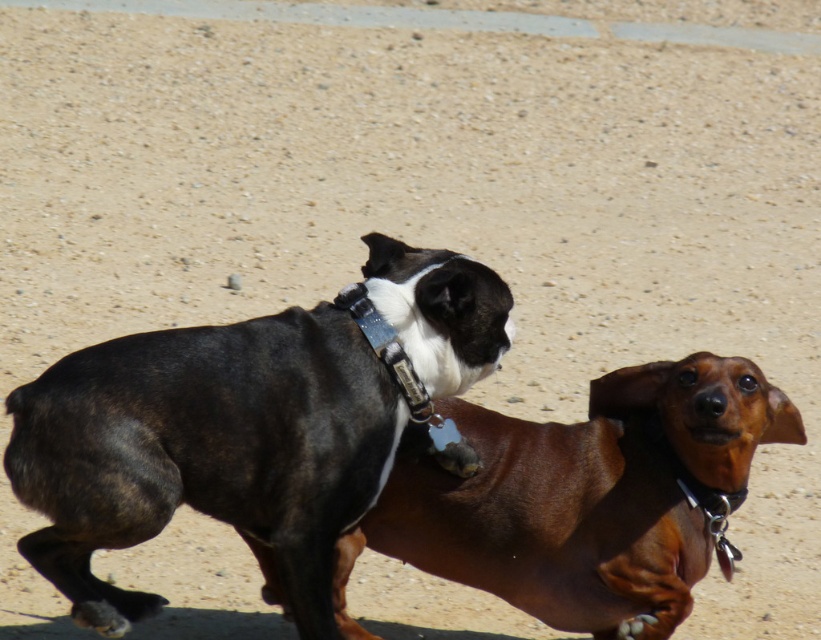
You are standing in a park and see a Dachshund and another dog running towards you. There is a point at coordinates point (187,419) between them. If you want to throw a ball to a spot exactly halfway between the two dogs, where should you aim? Please provide the coordinates of the midpoint between the two dogs.

The midpoint between the two dogs would be at point (187,419) since that is the point exactly halfway between them.

You are a photographer trying to capture both dogs in a single photo. Given that the black leather dog at center is taller than the brown shiny dachshund at center, which dog should you position closer to the camera to make them appear the same size in the photo?

To make the black leather dog at center and the brown shiny dachshund at center appear the same size in the photo, position the shorter brown shiny dachshund at center closer to the camera since it is smaller in height compared to the taller black leather dog at center.